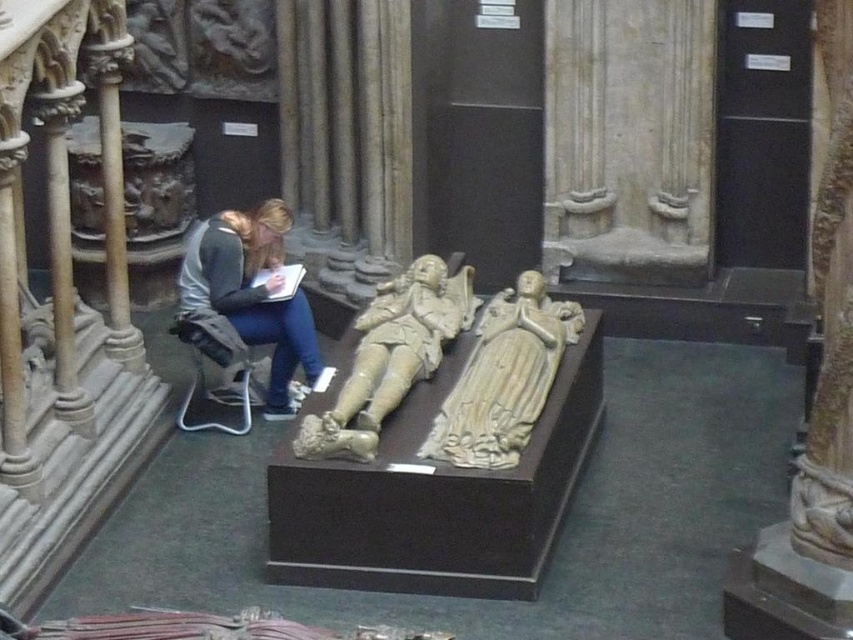
Between point (486, 312) and point (463, 268), which one is positioned in front?

Point (486, 312) is in front.

Is stone carving at center positioned in front of stone statue at center?

That is True.

This screenshot has width=853, height=640. Describe the element at coordinates (503, 378) in the screenshot. I see `stone carving at center` at that location.

This screenshot has width=853, height=640. Identify the location of stone carving at center. (503, 378).

Which is behind, point (508, 408) or point (280, 406)?

Positioned behind is point (280, 406).

Can you confirm if stone carving at center is positioned below denim jacket at lower left?

Indeed, stone carving at center is positioned under denim jacket at lower left.

Locate an element on the screen. stone carving at center is located at coordinates (503, 378).

Who is positioned more to the right, stone statue at center or denim jacket at lower left?

From the viewer's perspective, stone statue at center appears more on the right side.

Is stone statue at center positioned before denim jacket at lower left?

Yes.

Is point (376, 360) positioned behind point (299, 291)?

No, it is not.

Identify the location of stone statue at center. The height and width of the screenshot is (640, 853). (390, 356).